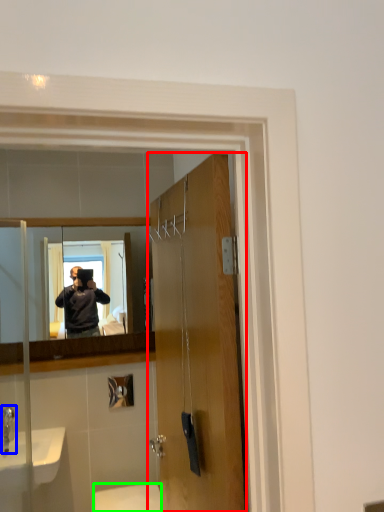
Question: Which is farther away from door (highlighted by a red box)? faucet (highlighted by a blue box) or toilet (highlighted by a green box)?

Choices:
 (A) faucet
 (B) toilet

Answer: (B)